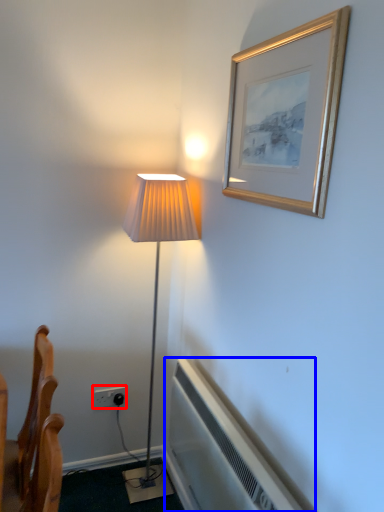
Question: Which point is closer to the camera, electric outlet (highlighted by a red box) or air conditioner (highlighted by a blue box)?

Choices:
 (A) electric outlet
 (B) air conditioner

Answer: (B)